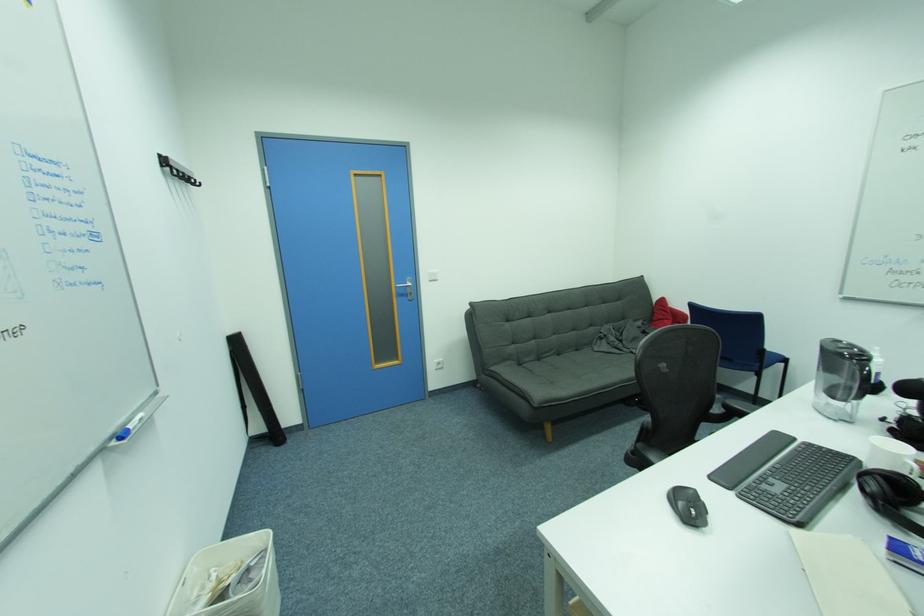
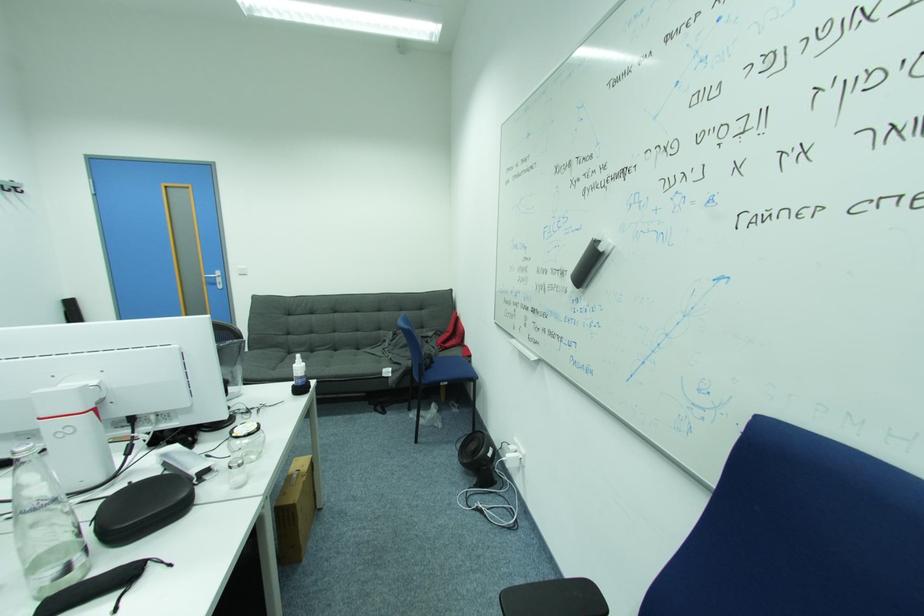
Find the pixel in the second image that matches point 602,339 in the first image.

(388, 341)